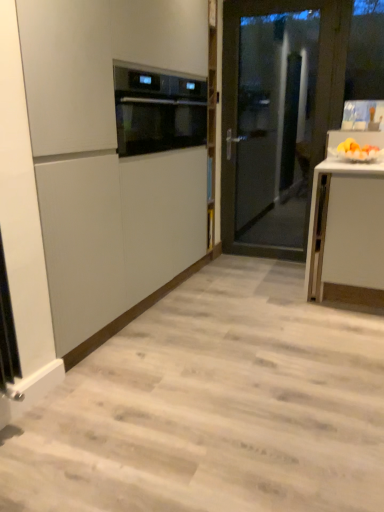
Question: Is satin black oven at upper center oriented towards yellow matte fruit at right?

Choices:
 (A) yes
 (B) no

Answer: (A)

Question: Does satin black oven at upper center have a greater width compared to yellow matte fruit at right?

Choices:
 (A) no
 (B) yes

Answer: (B)

Question: Is satin black oven at upper center not within yellow matte fruit at right?

Choices:
 (A) no
 (B) yes

Answer: (B)

Question: From a real-world perspective, does satin black oven at upper center sit lower than yellow matte fruit at right?

Choices:
 (A) no
 (B) yes

Answer: (A)

Question: Is satin black oven at upper center oriented away from yellow matte fruit at right?

Choices:
 (A) yes
 (B) no

Answer: (B)

Question: From a real-world perspective, relative to satin black oven at upper center, is matte white cabinet at center vertically above or below?

Choices:
 (A) below
 (B) above

Answer: (A)

Question: Based on their sizes in the image, would you say matte white cabinet at center is bigger or smaller than satin black oven at upper center?

Choices:
 (A) small
 (B) big

Answer: (B)

Question: Visually, is matte white cabinet at center positioned to the left or to the right of satin black oven at upper center?

Choices:
 (A) right
 (B) left

Answer: (B)

Question: From the image's perspective, is matte white cabinet at center positioned above or below satin black oven at upper center?

Choices:
 (A) above
 (B) below

Answer: (B)

Question: Relative to satin black oven at upper center, is yellow matte fruit at right in front or behind?

Choices:
 (A) behind
 (B) front

Answer: (B)

Question: From their relative heights in the image, would you say yellow matte fruit at right is taller or shorter than satin black oven at upper center?

Choices:
 (A) short
 (B) tall

Answer: (A)

Question: Based on their positions, is yellow matte fruit at right located to the left or right of satin black oven at upper center?

Choices:
 (A) left
 (B) right

Answer: (B)

Question: From a real-world perspective, is yellow matte fruit at right above or below satin black oven at upper center?

Choices:
 (A) below
 (B) above

Answer: (A)

Question: Is satin black oven at upper center situated inside yellow matte fruit at right or outside?

Choices:
 (A) outside
 (B) inside

Answer: (A)

Question: Is point (132, 72) positioned closer to the camera than point (362, 159)?

Choices:
 (A) closer
 (B) farther

Answer: (A)